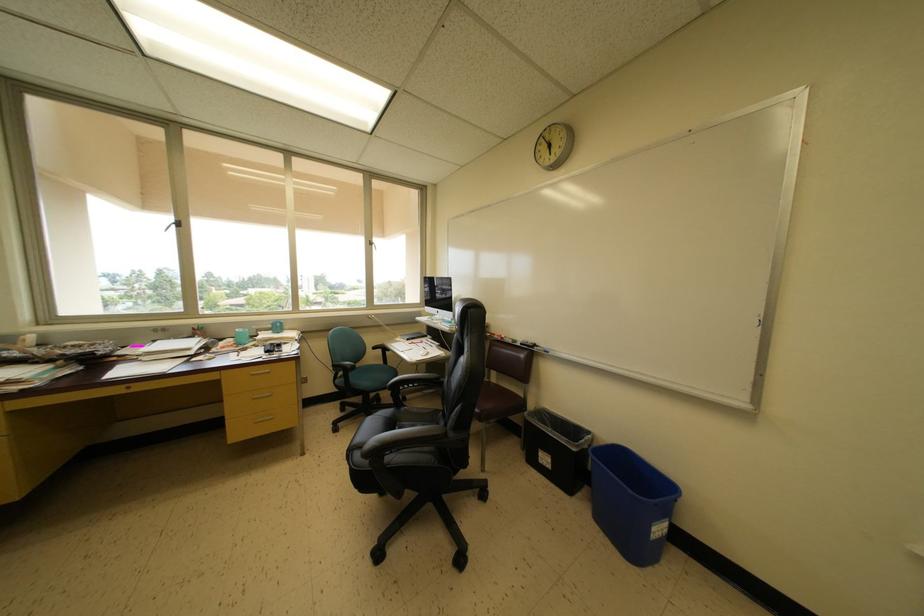
You are a GUI agent. You are given a task and a screenshot of the screen. Output one action in this format:
    pyautogui.click(x=<x>, y=<y>)
    Task: Click on the silver drawer handle
    This screenshot has width=924, height=616.
    Given the screenshot: What is the action you would take?
    pyautogui.click(x=260, y=371)